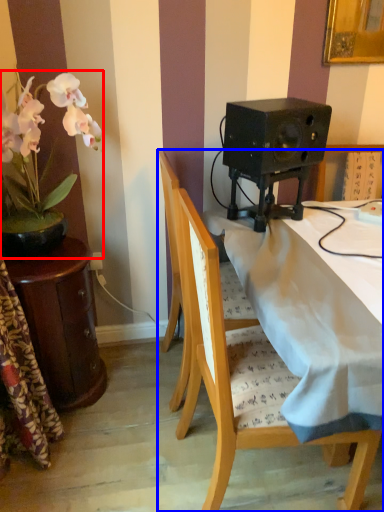
Question: Which of the following is the farthest to the observer, houseplant (highlighted by a red box) or chair (highlighted by a blue box)?

Choices:
 (A) houseplant
 (B) chair

Answer: (A)